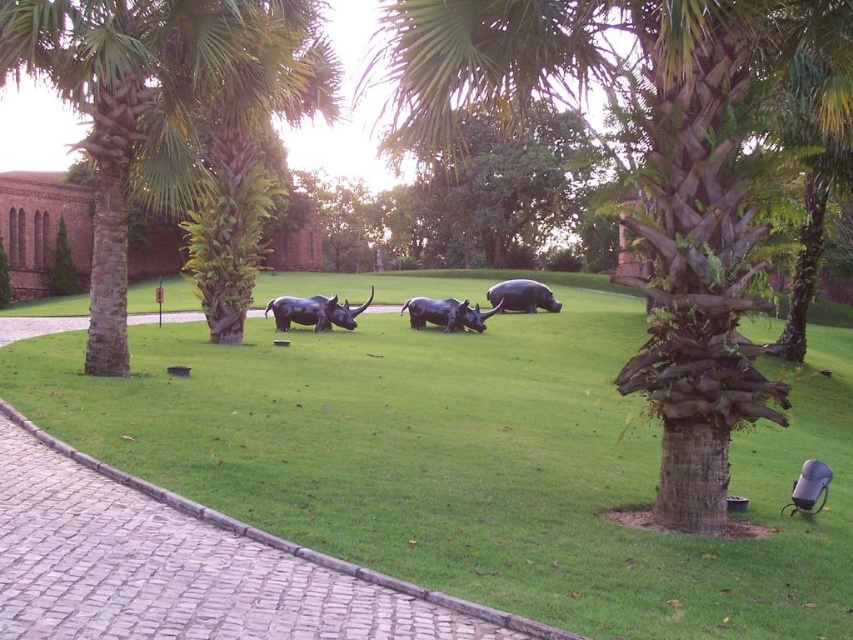
Is green grass at center smaller than black plastic chair at lower right?

No, green grass at center is not smaller than black plastic chair at lower right.

Is green grass at center below black plastic chair at lower right?

No, green grass at center is not below black plastic chair at lower right.

What do you see at coordinates (474, 461) in the screenshot? I see `green grass at center` at bounding box center [474, 461].

This screenshot has width=853, height=640. Find the location of `green grass at center`. green grass at center is located at coordinates (474, 461).

Can you confirm if polished black rhino at center is wider than shiny black buffalo at center?

Correct, the width of polished black rhino at center exceeds that of shiny black buffalo at center.

Where is `polished black rhino at center`? This screenshot has width=853, height=640. polished black rhino at center is located at coordinates (314, 310).

In order to click on polished black rhino at center in this screenshot , I will do `click(314, 310)`.

Is polished bronze buffalo at center wider than black plastic chair at lower right?

In fact, polished bronze buffalo at center might be narrower than black plastic chair at lower right.

In the scene shown: How far apart are polished bronze buffalo at center and black plastic chair at lower right?

The distance of polished bronze buffalo at center from black plastic chair at lower right is 16.89 meters.

Identify the location of polished bronze buffalo at center. Image resolution: width=853 pixels, height=640 pixels. (445, 314).